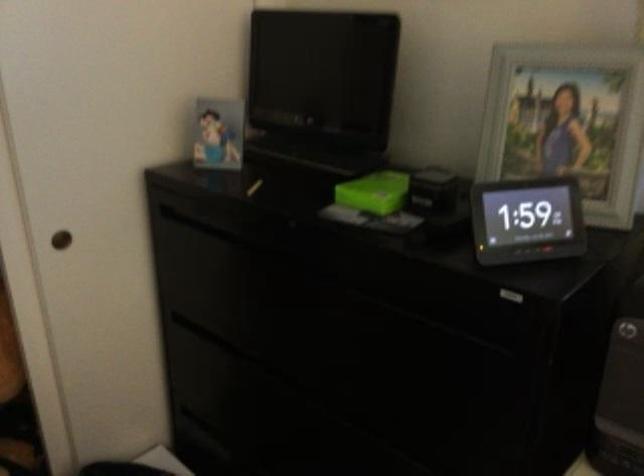
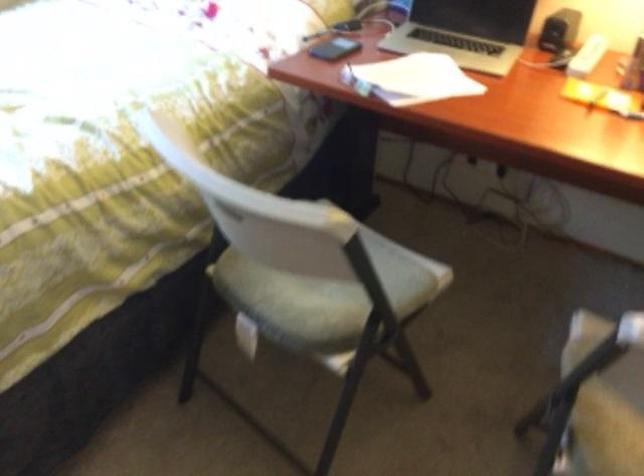
The first image is from the beginning of the video and the second image is from the end. How did the camera likely rotate when shooting the video?

The camera rotated toward right-down.